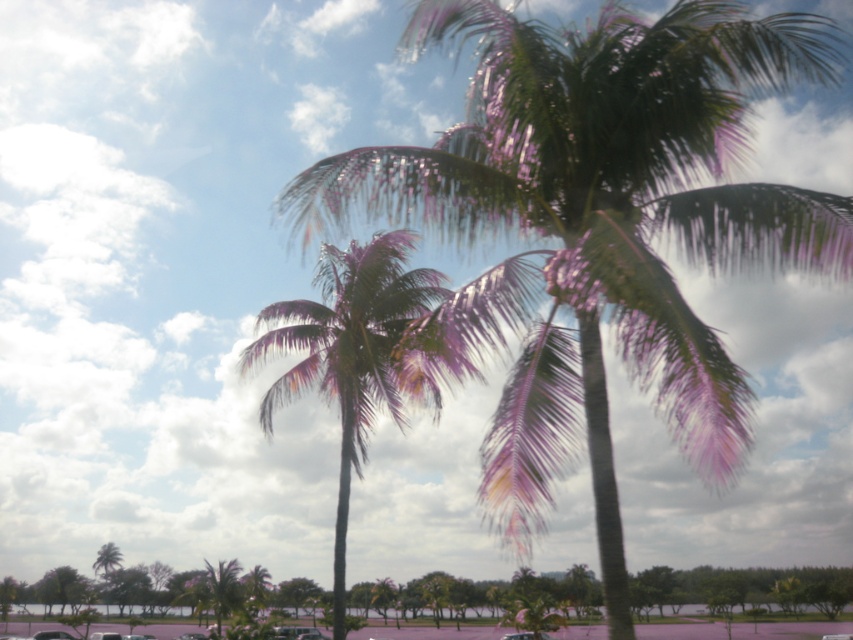
Question: Does green leafy coconut tree at center have a smaller size compared to green leafy palm tree at center?

Choices:
 (A) yes
 (B) no

Answer: (B)

Question: Can you confirm if green leafy coconut tree at center is positioned to the left of green leafy palm tree at center?

Choices:
 (A) yes
 (B) no

Answer: (B)

Question: Among these objects, which one is farthest from the camera?

Choices:
 (A) green leafy coconut tree at center
 (B) green leafy palm tree at center

Answer: (B)

Question: Which of the following is the closest to the observer?

Choices:
 (A) (844, 204)
 (B) (328, 374)

Answer: (A)

Question: Can you confirm if green leafy coconut tree at center is positioned to the left of green leafy palm tree at center?

Choices:
 (A) yes
 (B) no

Answer: (B)